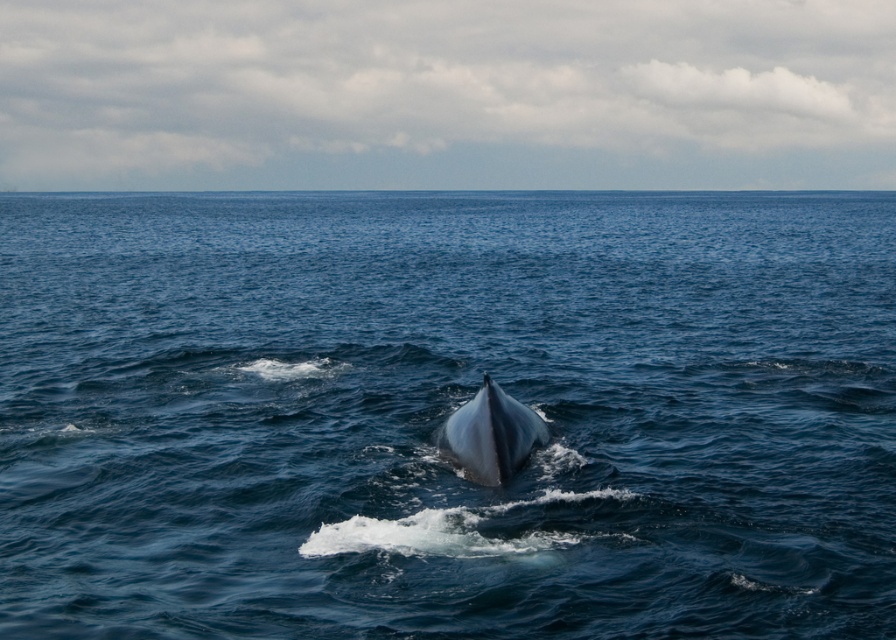
Consider the image. Does blue water at center have a smaller size compared to gray smooth whale at center?

Actually, blue water at center might be larger than gray smooth whale at center.

Can you confirm if blue water at center is taller than gray smooth whale at center?

Indeed, blue water at center has a greater height compared to gray smooth whale at center.

Measure the distance between point (755, 481) and camera.

Point (755, 481) and camera are 9.02 meters apart.

Where is `blue water at center`? The image size is (896, 640). blue water at center is located at coordinates (446, 413).